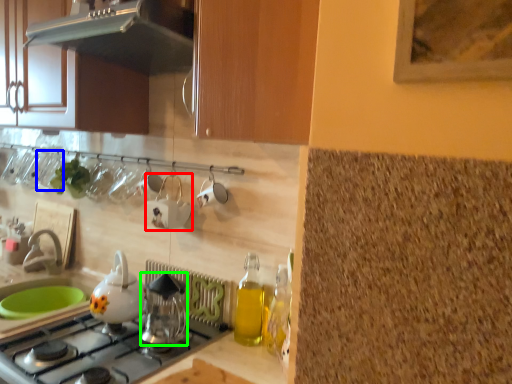
Question: Estimate the real-world distances between objects in this image. Which object is farther from appliance (highlighted by a red box), tableware (highlighted by a blue box) or kitchen appliance (highlighted by a green box)?

Choices:
 (A) tableware
 (B) kitchen appliance

Answer: (A)